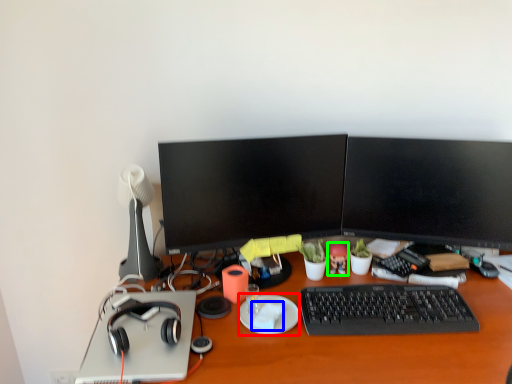
Question: Considering the real-world distances, which object is closest to plate (highlighted by a red box)? notepad (highlighted by a blue box) or toy (highlighted by a green box).

Choices:
 (A) notepad
 (B) toy

Answer: (A)